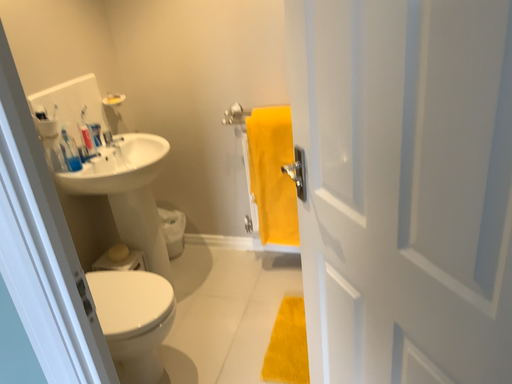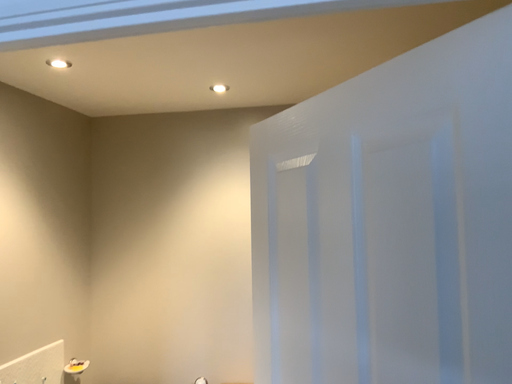
Question: Which way did the camera rotate in the video?

Choices:
 (A) rotated downward
 (B) rotated upward

Answer: (B)